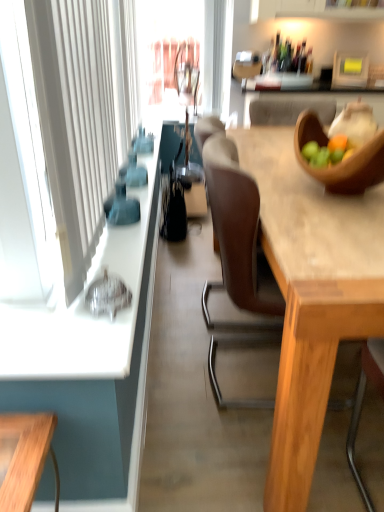
Question: Is wooden table at center looking in the opposite direction of white fabric curtain at left?

Choices:
 (A) yes
 (B) no

Answer: (B)

Question: From the image's perspective, would you say wooden table at center is shown under white fabric curtain at left?

Choices:
 (A) yes
 (B) no

Answer: (A)

Question: From a real-world perspective, is wooden table at center positioned under white fabric curtain at left based on gravity?

Choices:
 (A) yes
 (B) no

Answer: (A)

Question: Is wooden table at center at the left side of white fabric curtain at left?

Choices:
 (A) yes
 (B) no

Answer: (B)

Question: From a real-world perspective, is wooden table at center positioned over white fabric curtain at left based on gravity?

Choices:
 (A) no
 (B) yes

Answer: (A)

Question: Is wooden table at center in contact with white fabric curtain at left?

Choices:
 (A) yes
 (B) no

Answer: (B)

Question: Can you confirm if white fabric curtain at left is wider than wooden table at center?

Choices:
 (A) yes
 (B) no

Answer: (B)

Question: From a real-world perspective, is white fabric curtain at left over wooden table at center?

Choices:
 (A) yes
 (B) no

Answer: (A)

Question: Could you tell me if white fabric curtain at left is facing wooden table at center?

Choices:
 (A) yes
 (B) no

Answer: (B)

Question: Does white fabric curtain at left appear on the right side of wooden table at center?

Choices:
 (A) no
 (B) yes

Answer: (A)

Question: Would you say white fabric curtain at left is a long distance from wooden table at center?

Choices:
 (A) no
 (B) yes

Answer: (A)

Question: Is white fabric curtain at left shorter than wooden table at center?

Choices:
 (A) no
 (B) yes

Answer: (A)

Question: Considering the relative sizes of white fabric curtain at left and black leather handbag at center in the image provided, is white fabric curtain at left taller than black leather handbag at center?

Choices:
 (A) no
 (B) yes

Answer: (B)